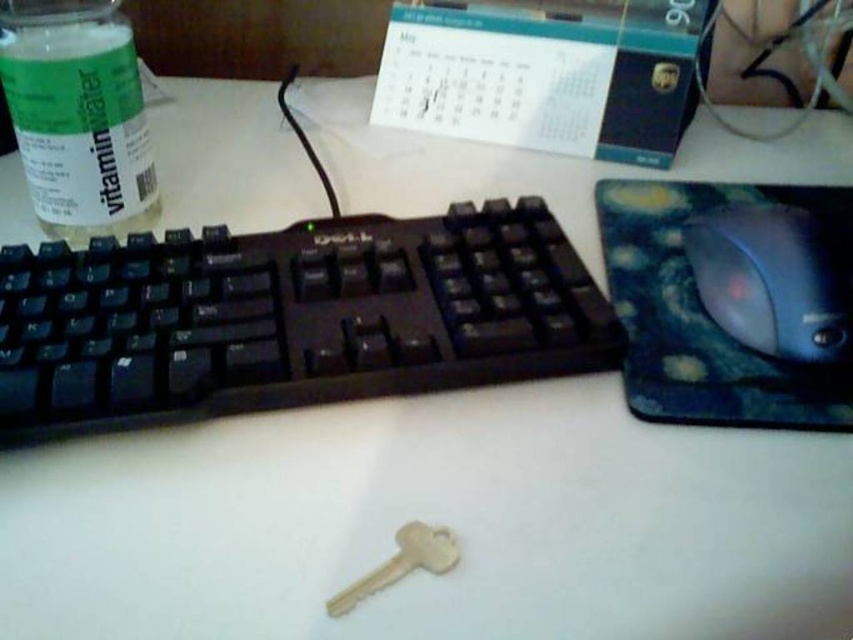
Which is more to the left, green plastic bottle at upper left or gold metallic key at center?

Positioned to the left is green plastic bottle at upper left.

Who is more forward, (65,60) or (444,529)?

Point (444,529) is more forward.

This screenshot has height=640, width=853. What are the coordinates of `green plastic bottle at upper left` in the screenshot? It's located at (78, 115).

Can you confirm if black plastic keyboard at center is positioned to the right of blue plastic mouse at right?

Incorrect, black plastic keyboard at center is not on the right side of blue plastic mouse at right.

Does black plastic keyboard at center appear on the left side of blue plastic mouse at right?

Indeed, black plastic keyboard at center is positioned on the left side of blue plastic mouse at right.

Locate an element on the screen. black plastic keyboard at center is located at coordinates (289, 317).

Who is positioned more to the left, black plastic keyboard at center or green plastic bottle at upper left?

green plastic bottle at upper left is more to the left.

Who is lower down, black plastic keyboard at center or green plastic bottle at upper left?

black plastic keyboard at center is below.

Which is in front, point (289, 397) or point (64, 236)?

Point (289, 397) is more forward.

Image resolution: width=853 pixels, height=640 pixels. Identify the location of black plastic keyboard at center. (289, 317).